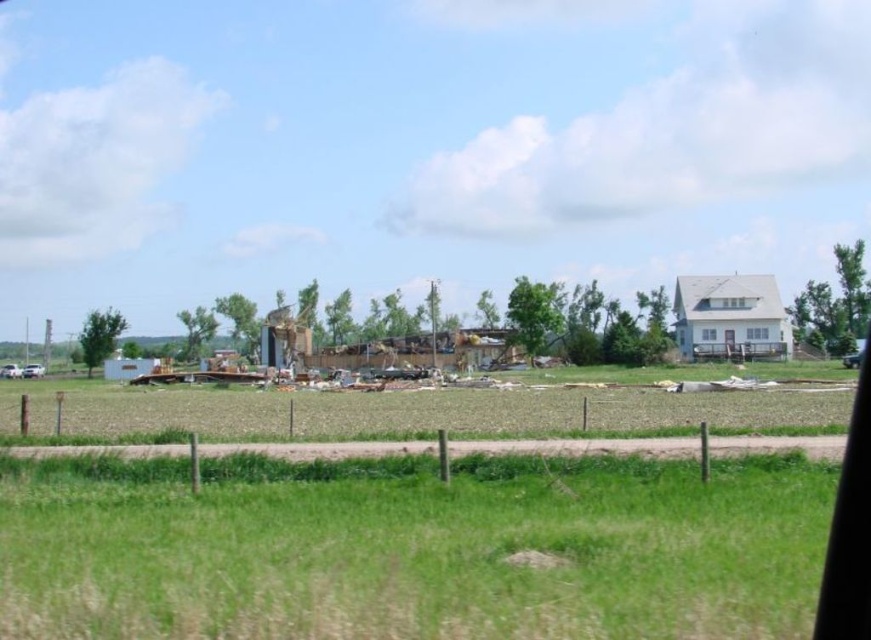
Question: Which point appears closest to the camera in this image?

Choices:
 (A) (848, 381)
 (B) (294, 504)

Answer: (B)

Question: Can you confirm if green grass at lower center is smaller than brown dirt field at center?

Choices:
 (A) yes
 (B) no

Answer: (A)

Question: From the image, what is the correct spatial relationship of green grass at lower center in relation to brown dirt field at center?

Choices:
 (A) above
 (B) below

Answer: (A)

Question: Among these objects, which one is nearest to the camera?

Choices:
 (A) brown dirt field at center
 (B) green grass at lower center

Answer: (B)

Question: Can you confirm if green grass at lower center is bigger than brown dirt field at center?

Choices:
 (A) yes
 (B) no

Answer: (B)